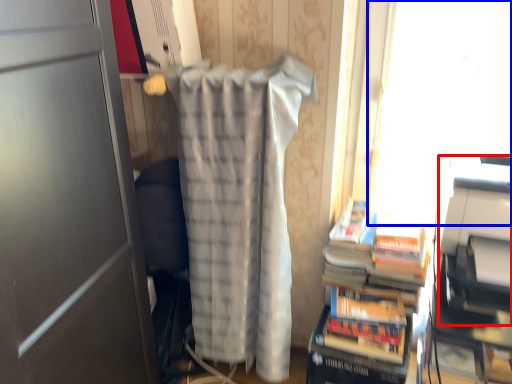
Question: Which point is closer to the camera, printer (highlighted by a red box) or window screen (highlighted by a blue box)?

Choices:
 (A) printer
 (B) window screen

Answer: (A)